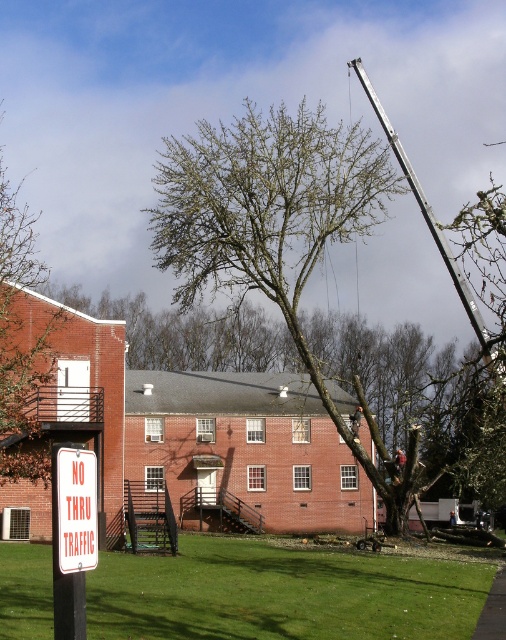
Question: Among these points, which one is nearest to the camera?

Choices:
 (A) tap(58, 532)
 (B) tap(10, 209)
 (C) tap(181, 141)
 (D) tap(423, 616)

Answer: (A)

Question: Does bare branches at center have a lesser width compared to white plastic sign at lower left?

Choices:
 (A) no
 (B) yes

Answer: (A)

Question: Among these points, which one is nearest to the camera?

Choices:
 (A) (0, 160)
 (B) (83, 483)
 (C) (187, 266)

Answer: (B)

Question: Does green grass at lower center have a smaller size compared to white plastic sign at lower left?

Choices:
 (A) yes
 (B) no

Answer: (B)

Question: In this image, where is bare branches at center located relative to brown leafy tree at upper left?

Choices:
 (A) above
 (B) below

Answer: (A)

Question: Which of these objects is positioned closest to the green grass at lower center?

Choices:
 (A) bare branches at center
 (B) brown leafy tree at upper left
 (C) white plastic sign at lower left

Answer: (B)